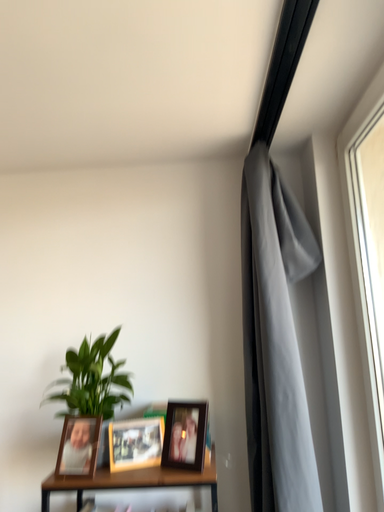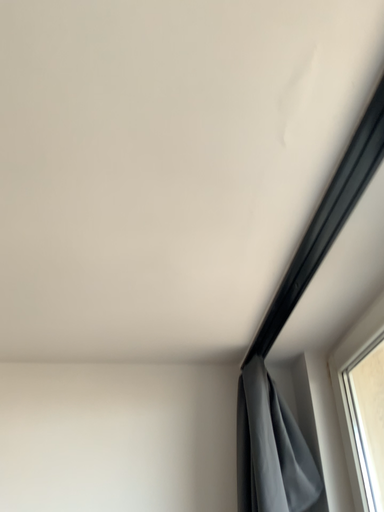
Question: Which way did the camera rotate in the video?

Choices:
 (A) rotated upward
 (B) rotated downward

Answer: (A)